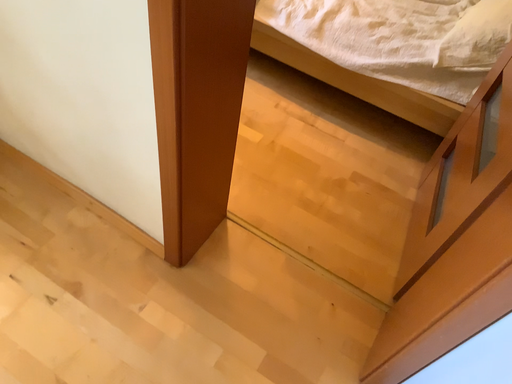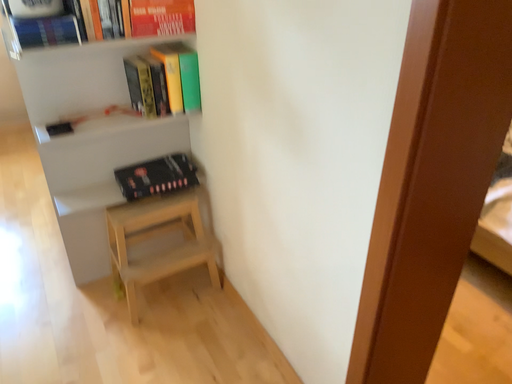
Question: How did the camera likely rotate when shooting the video?

Choices:
 (A) rotated upward
 (B) rotated downward

Answer: (A)